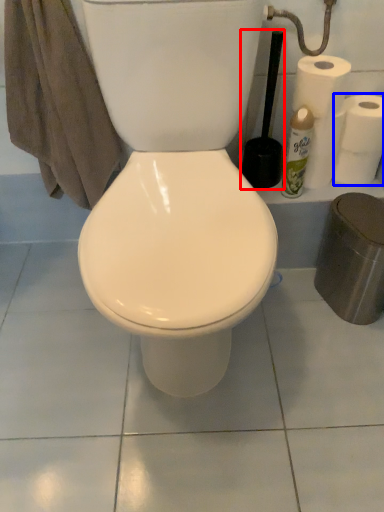
Question: Which object appears farthest to the camera in this image, brush (highlighted by a red box) or toilet paper (highlighted by a blue box)?

Choices:
 (A) brush
 (B) toilet paper

Answer: (B)